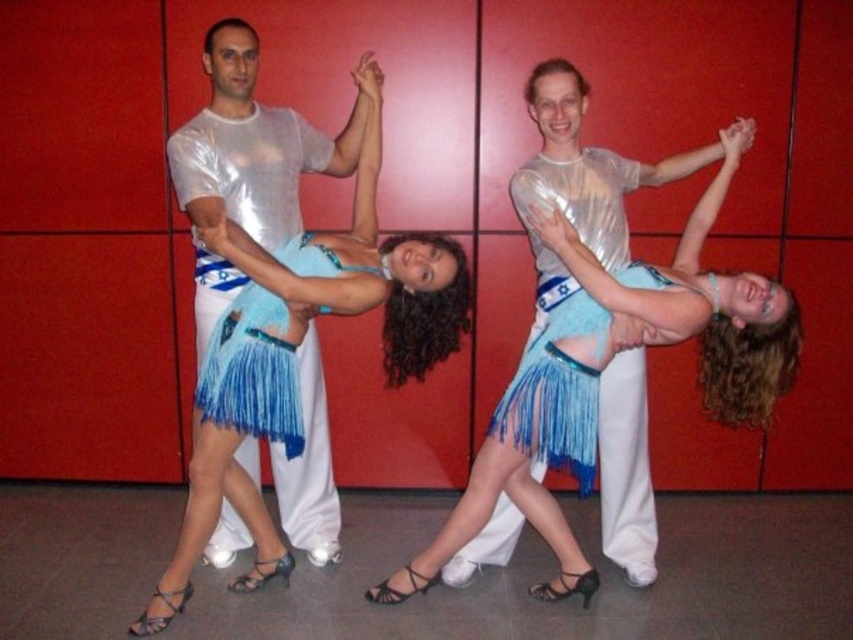
Question: Based on their relative distances, which object is farther from the fringed blue fabric skirt at center?

Choices:
 (A) shiny metallic shirt at center
 (B) shiny blue skirt at center

Answer: (B)

Question: Is shiny blue skirt at center to the left of shiny metallic shirt at center from the viewer's perspective?

Choices:
 (A) no
 (B) yes

Answer: (A)

Question: Which point is closer to the camera taking this photo?

Choices:
 (A) (212, 342)
 (B) (619, 304)

Answer: (B)

Question: Is shiny metallic shirt at center closer to camera compared to fringed blue fabric skirt at center?

Choices:
 (A) no
 (B) yes

Answer: (B)

Question: Can you confirm if shiny metallic shirt at center is bigger than fringed blue fabric skirt at center?

Choices:
 (A) no
 (B) yes

Answer: (B)

Question: Which is farther from the shiny metallic shirt at center?

Choices:
 (A) fringed blue fabric skirt at center
 (B) shiny blue skirt at center

Answer: (B)